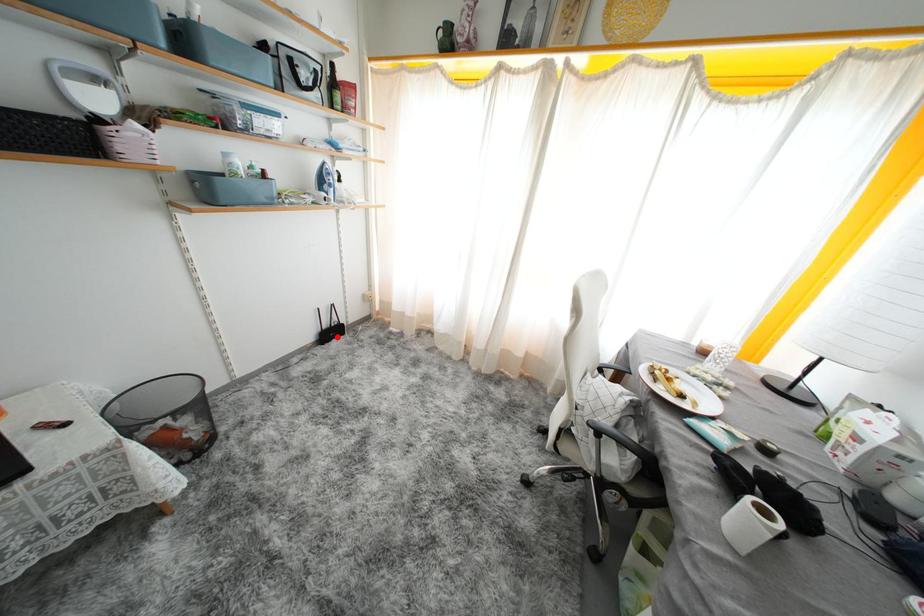
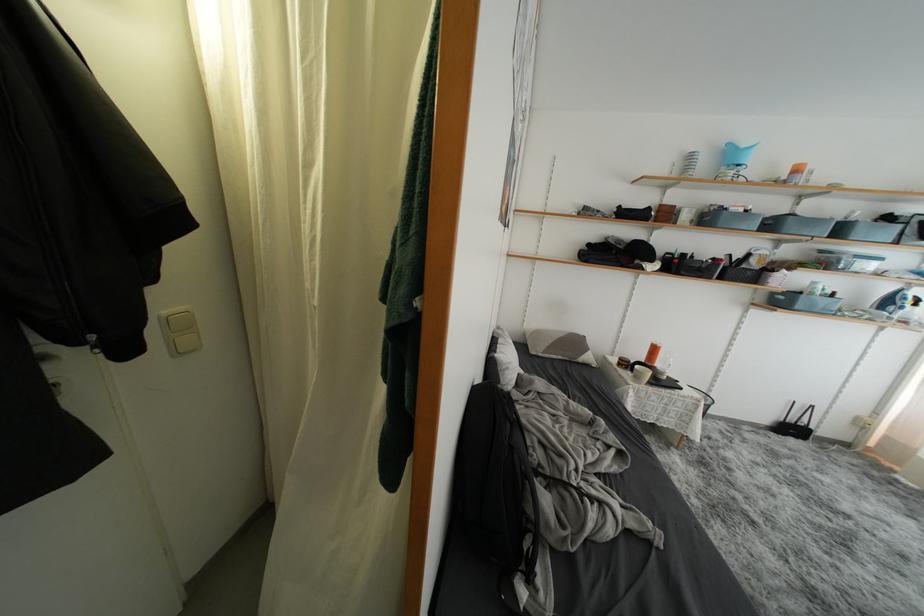
Where in the second image is the point corresponding to the highlighted location from the first image?

(797, 434)